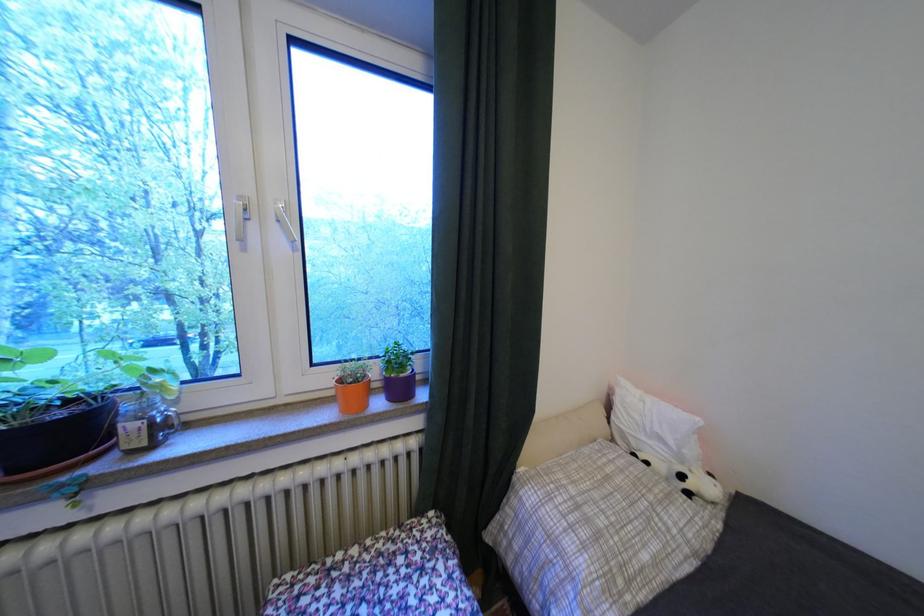
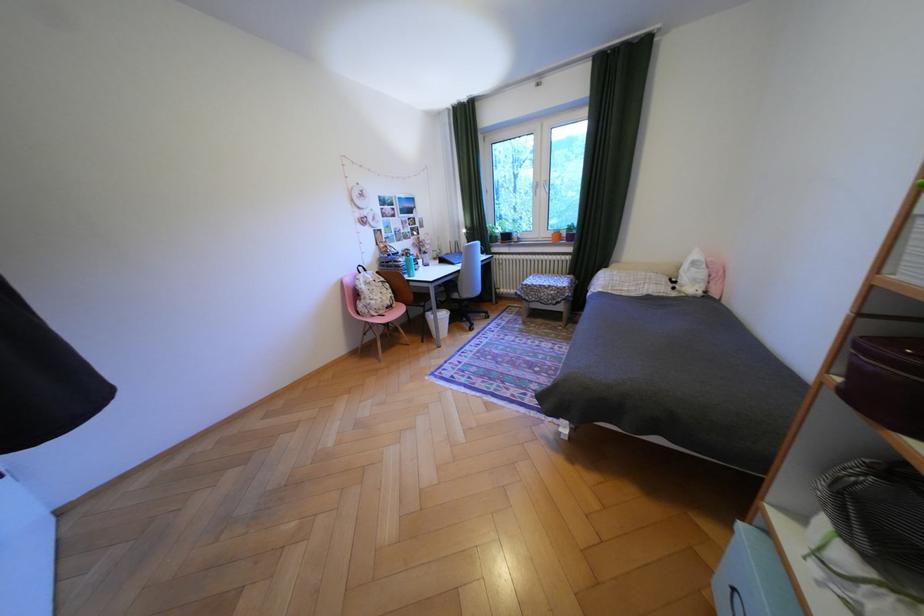
In the second image, find the point that corresponds to point 694,477 in the first image.

(687, 282)